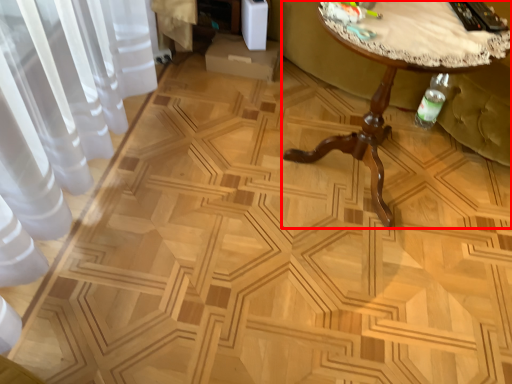
Question: From the image's perspective, where is table (annotated by the red box) located relative to swivel chair?

Choices:
 (A) below
 (B) above

Answer: (A)